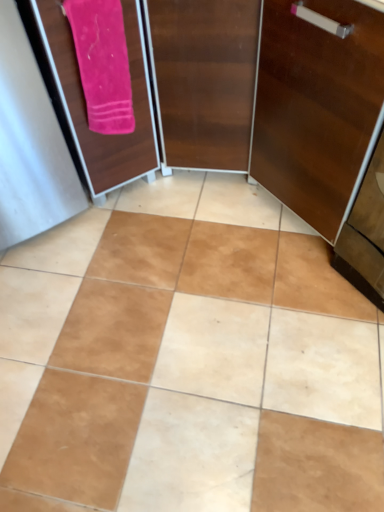
Question: In terms of size, does wooden cabinet at right appear bigger or smaller than pink soft towel at upper left?

Choices:
 (A) big
 (B) small

Answer: (A)

Question: Looking at their shapes, would you say wooden cabinet at right is wider or thinner than pink soft towel at upper left?

Choices:
 (A) wide
 (B) thin

Answer: (A)

Question: Based on their relative distances, which object is farther from the brown matte tile at center?

Choices:
 (A) wooden cabinet at right
 (B) pink fabric screen door at upper left
 (C) pink soft towel at upper left

Answer: (C)

Question: Estimate the real-world distances between objects in this image. Which object is farther from the wooden cabinet at right?

Choices:
 (A) brown matte tile at center
 (B) pink soft towel at upper left
 (C) pink fabric screen door at upper left

Answer: (A)